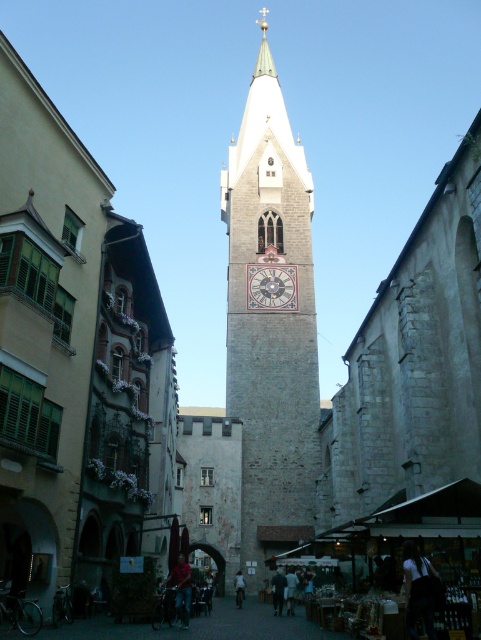
Question: Which of the following is the closest to the observer?

Choices:
 (A) white painted stone clock at center
 (B) white stone clock tower at center

Answer: (B)

Question: Can you confirm if white stone clock tower at center is wider than white painted stone clock at center?

Choices:
 (A) no
 (B) yes

Answer: (B)

Question: Is white stone clock tower at center positioned behind white painted stone clock at center?

Choices:
 (A) yes
 (B) no

Answer: (B)

Question: Does white stone clock tower at center have a lesser width compared to white painted stone clock at center?

Choices:
 (A) yes
 (B) no

Answer: (B)